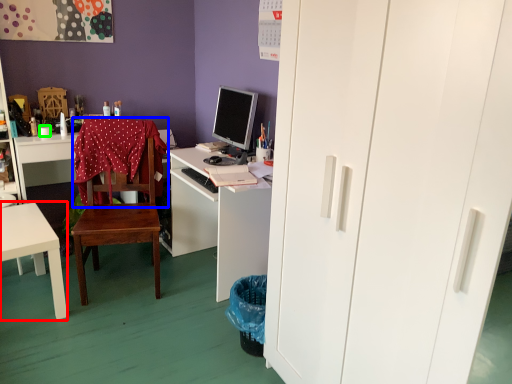
Question: Which object is the closest to the desk (highlighted by a red box)? Choose among these: tablecloth (highlighted by a blue box) or coffee cup (highlighted by a green box).

Choices:
 (A) tablecloth
 (B) coffee cup

Answer: (A)